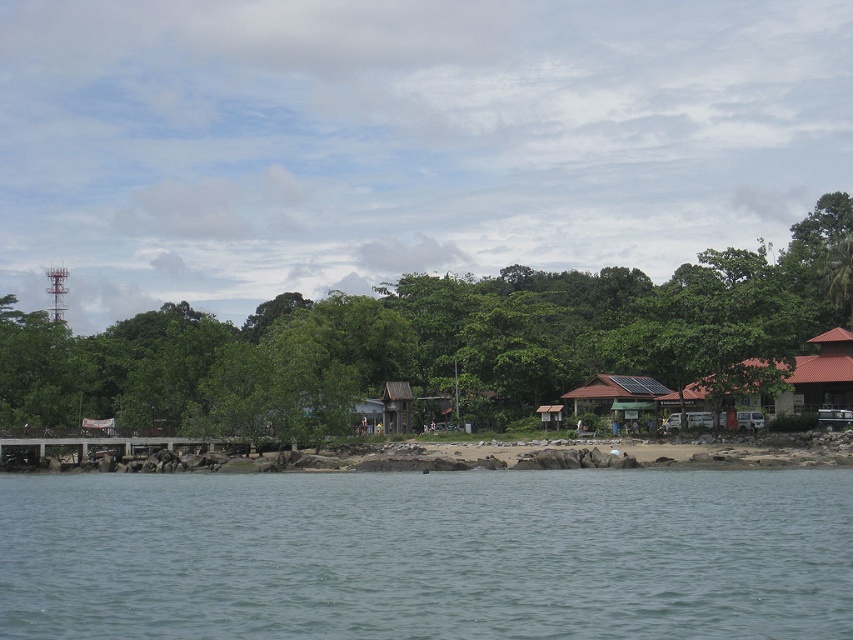
Is point (810, 342) farther from viewer compared to point (637, 380)?

No, (810, 342) is in front of (637, 380).

Is point (836, 326) in front of point (621, 422)?

No, it is behind (621, 422).

Locate an element on the screen. The image size is (853, 640). brown corrugated metal hut at right is located at coordinates pyautogui.click(x=799, y=378).

The height and width of the screenshot is (640, 853). Describe the element at coordinates (799, 378) in the screenshot. I see `brown corrugated metal hut at right` at that location.

Does brown corrugated metal hut at right have a lesser width compared to brown wooden dock at lower left?

Yes.

Where is `brown corrugated metal hut at right`? The height and width of the screenshot is (640, 853). brown corrugated metal hut at right is located at coordinates (799, 378).

Locate an element on the screen. This screenshot has width=853, height=640. brown corrugated metal hut at right is located at coordinates (799, 378).

Which is below, green leafy tree at center or brown wooden hut at center-right?

brown wooden hut at center-right

Consider the image. Is green leafy tree at center smaller than brown wooden hut at center-right?

No, green leafy tree at center is not smaller than brown wooden hut at center-right.

What do you see at coordinates (428, 340) in the screenshot? I see `green leafy tree at center` at bounding box center [428, 340].

Find the location of a particular element. The height and width of the screenshot is (640, 853). green leafy tree at center is located at coordinates (428, 340).